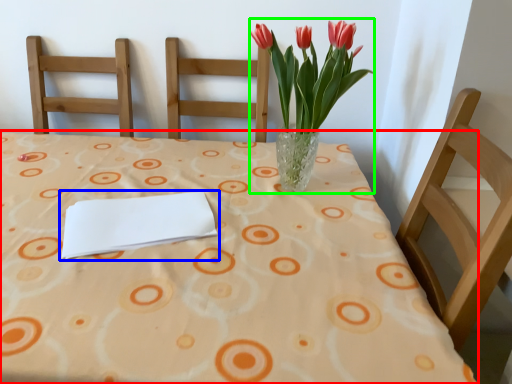
Question: Which object is positioned closest to table (highlighted by a red box)? Select from journal (highlighted by a blue box) and floral arrangement (highlighted by a green box).

Choices:
 (A) journal
 (B) floral arrangement

Answer: (A)